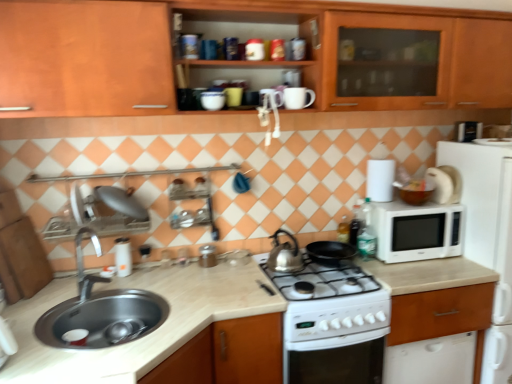
Question: Can you confirm if wooden cabinet at right, which is the 1th cabinetry from bottom to top, is bigger than metallic silver toaster at upper right, which is the third appliance in left-to-right order?

Choices:
 (A) yes
 (B) no

Answer: (A)

Question: Does wooden cabinet at right, which is the 1th cabinetry from bottom to top, have a smaller size compared to metallic silver toaster at upper right, the 1th appliance positioned from the right?

Choices:
 (A) yes
 (B) no

Answer: (B)

Question: From the image's perspective, is wooden cabinet at right, which is the 1th cabinetry from bottom to top, over metallic silver toaster at upper right, which is the third appliance in left-to-right order?

Choices:
 (A) yes
 (B) no

Answer: (B)

Question: Does wooden cabinet at right, which is the 3th cabinetry in top-to-bottom order, appear on the right side of metallic silver toaster at upper right, which is the third appliance in left-to-right order?

Choices:
 (A) yes
 (B) no

Answer: (B)

Question: Is wooden cabinet at right, which is the 3th cabinetry in top-to-bottom order, further to camera compared to metallic silver toaster at upper right, which is counted as the 3th appliance, starting from the bottom?

Choices:
 (A) no
 (B) yes

Answer: (A)

Question: Based on their sizes in the image, would you say metallic silver canister at center, the second appliance positioned from the back, is bigger or smaller than satin silver kettle at center?

Choices:
 (A) small
 (B) big

Answer: (A)

Question: From their relative heights in the image, would you say metallic silver canister at center, marked as the 2th appliance in a right-to-left arrangement, is taller or shorter than satin silver kettle at center?

Choices:
 (A) short
 (B) tall

Answer: (A)

Question: Choose the correct answer: Is metallic silver canister at center, which is the 3th appliance from top to bottom, inside satin silver kettle at center or outside it?

Choices:
 (A) outside
 (B) inside

Answer: (A)

Question: Visually, is metallic silver canister at center, the second appliance positioned from the back, positioned to the left or to the right of satin silver kettle at center?

Choices:
 (A) right
 (B) left

Answer: (B)

Question: Considering the positions of white matte microwave at right and wooden cabinet at right, which is the 1th cabinetry from bottom to top, in the image, is white matte microwave at right bigger or smaller than wooden cabinet at right, which is the 1th cabinetry from bottom to top,?

Choices:
 (A) big
 (B) small

Answer: (A)

Question: Looking at their shapes, would you say white matte microwave at right is wider or thinner than wooden cabinet at right, which is the 3th cabinetry in top-to-bottom order?

Choices:
 (A) wide
 (B) thin

Answer: (A)

Question: Considering the positions of point click(x=508, y=360) and point click(x=411, y=332), is point click(x=508, y=360) closer or farther from the camera than point click(x=411, y=332)?

Choices:
 (A) closer
 (B) farther

Answer: (B)

Question: Relative to wooden cabinet at right, which is the 3th cabinetry in top-to-bottom order, is white matte microwave at right in front or behind?

Choices:
 (A) behind
 (B) front

Answer: (B)

Question: Is metallic silver canister at center, marked as the 2th appliance in a right-to-left arrangement, wider or thinner than wooden cabinet at upper center, which appears as the first cabinetry when viewed from the top?

Choices:
 (A) wide
 (B) thin

Answer: (B)

Question: Is metallic silver canister at center, the 1th appliance ordered from the bottom, bigger or smaller than wooden cabinet at upper center, which appears as the 3th cabinetry when ordered from the bottom?

Choices:
 (A) small
 (B) big

Answer: (A)